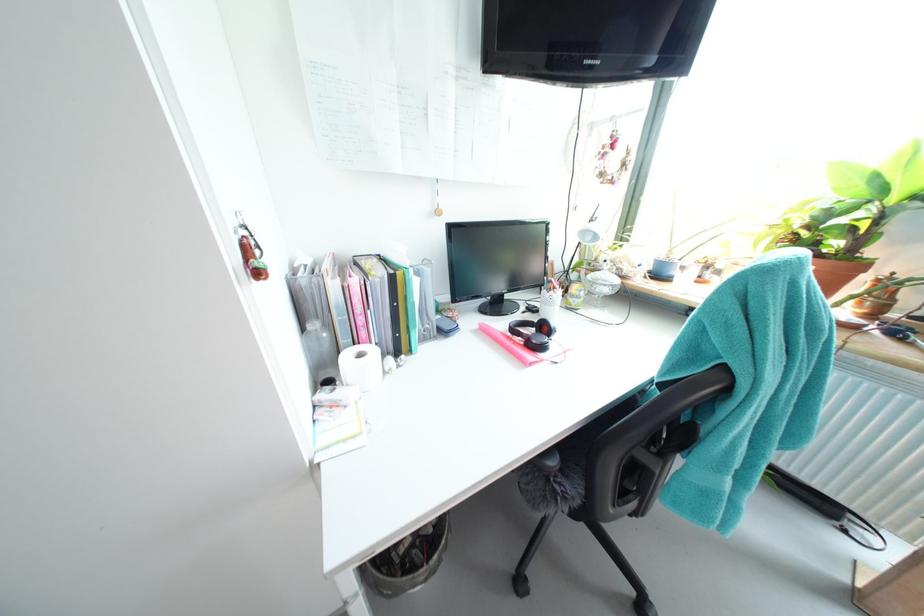
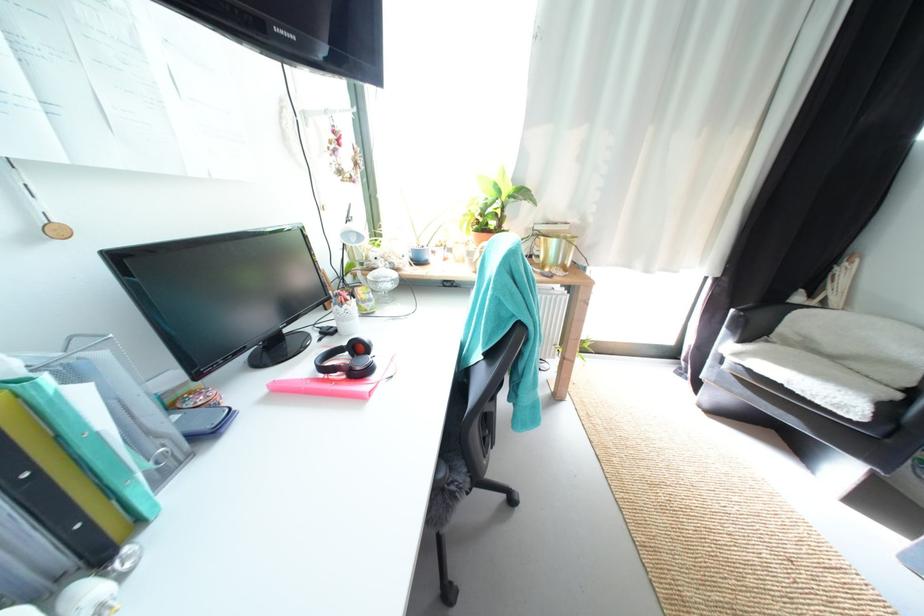
Find the pixel in the second image that matches pixel 586 299 in the first image.

(378, 302)